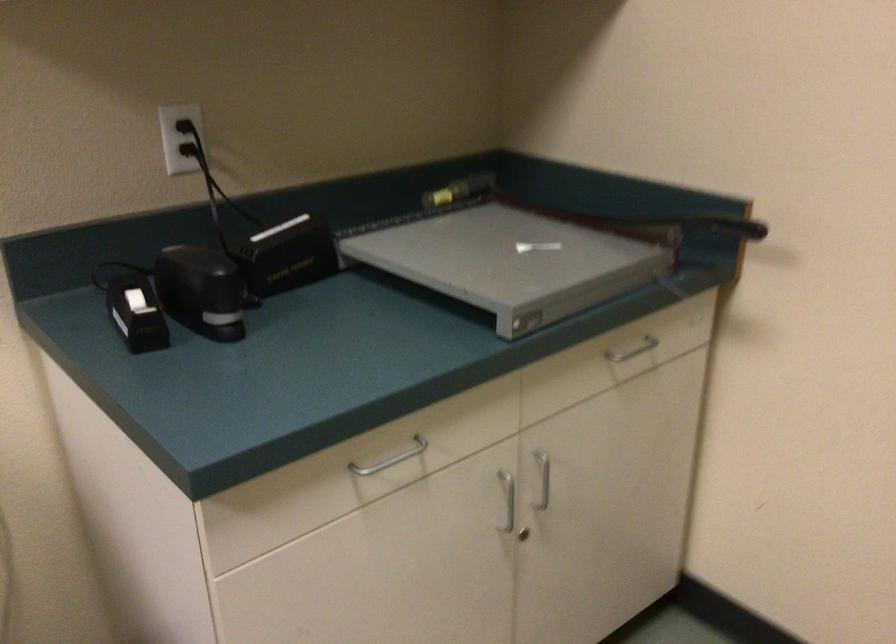
Describe the element at coordinates (522, 534) in the screenshot. Image resolution: width=896 pixels, height=644 pixels. I see `the silver cabinet lock` at that location.